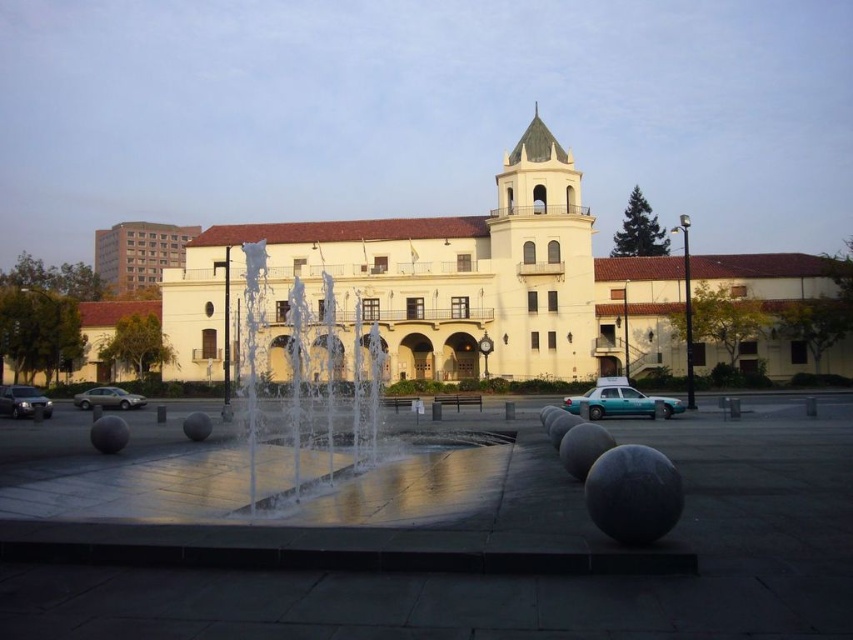
You are a pedestrian standing on the plaza in front of the building. You see a teal glossy taxi at center and a matte silver suv at lower left. Which vehicle is closer to the fountain in the plaza?

The teal glossy taxi at center is closer to the fountain in the plaza because it is positioned above the matte silver suv at lower left, indicating it is nearer in the scene.

You are standing at the entrance of the Spanish colonial building and see two points marked on the ground. The first point is labeled as point (7, 611) and the second as point (672, 408). From your position at the entrance, which point is closer to you?

Point (7, 611) is in front of point (672, 408), so it is closer to you.

Looking at this image, you are standing at the entrance of the building and want to hail a teal glossy taxi at center. According to the coordinates provided, in which direction should you walk to reach it?

The teal glossy taxi at center is located at coordinates point [619,403], so you should walk forward from the entrance towards the center of the plaza to reach it.